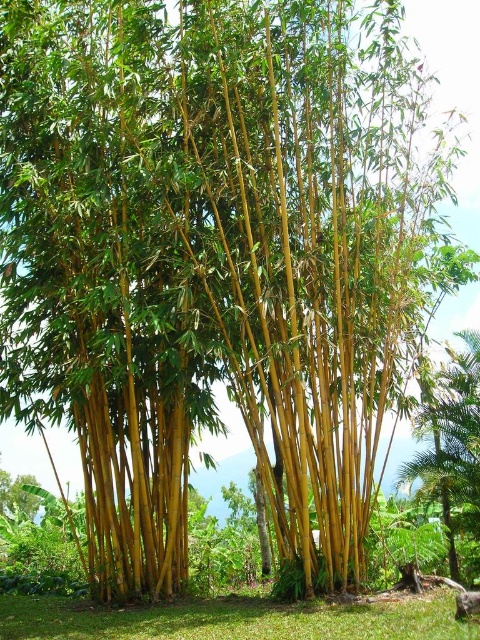
Which is more to the right, green bamboo at lower right or green leafy tree at lower left?

green bamboo at lower right is more to the right.

Between point (475, 387) and point (10, 490), which one is positioned in front?

Positioned in front is point (475, 387).

Between point (428, 381) and point (27, 504), which one is positioned behind?

The point (27, 504) is behind.

You are a GUI agent. You are given a task and a screenshot of the screen. Output one action in this format:
    pyautogui.click(x=<x>, y=<y>)
    Task: Click on the green bamboo at lower right
    The width and height of the screenshot is (480, 640).
    Given the screenshot: What is the action you would take?
    pyautogui.click(x=452, y=444)